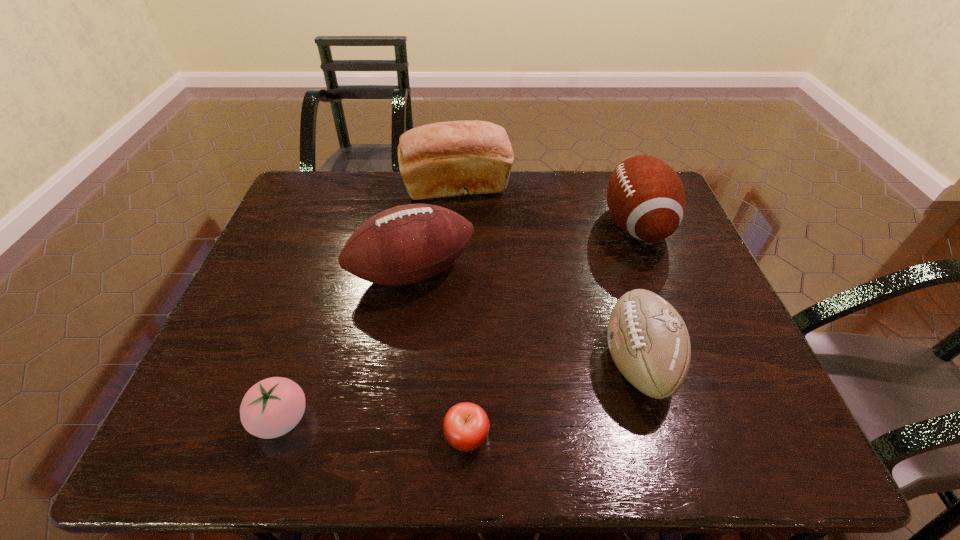
Where is `object present at the far right corner`? This screenshot has height=540, width=960. object present at the far right corner is located at coordinates (645, 196).

Where is `free space at the far edge of the desktop`? free space at the far edge of the desktop is located at coordinates (543, 214).

Locate an element on the screen. Image resolution: width=960 pixels, height=540 pixels. vacant position at the near edge of the desktop is located at coordinates (570, 432).

Find the location of `blank area at the left edge`. blank area at the left edge is located at coordinates 299,288.

Find the location of a particular element. The image size is (960, 540). vacant space at the right edge of the desktop is located at coordinates (725, 374).

In the image, there is a desktop. Identify the location of vacant space at the far left corner. This screenshot has height=540, width=960. (339, 197).

In the image, there is a desktop. Where is `vacant space at the near left corner`? vacant space at the near left corner is located at coordinates (224, 434).

You are a GUI agent. You are given a task and a screenshot of the screen. Output one action in this format:
    pyautogui.click(x=<x>, y=<y>)
    Task: Click on the vacant point located between the bread and the second shortest object
    This screenshot has height=540, width=960.
    Given the screenshot: What is the action you would take?
    pyautogui.click(x=370, y=304)

Where is `free space between the shortest football (American) and the bread`? This screenshot has height=540, width=960. free space between the shortest football (American) and the bread is located at coordinates (547, 275).

In order to click on vacant area that lies between the shortest object and the bread in this screenshot , I will do pos(462,312).